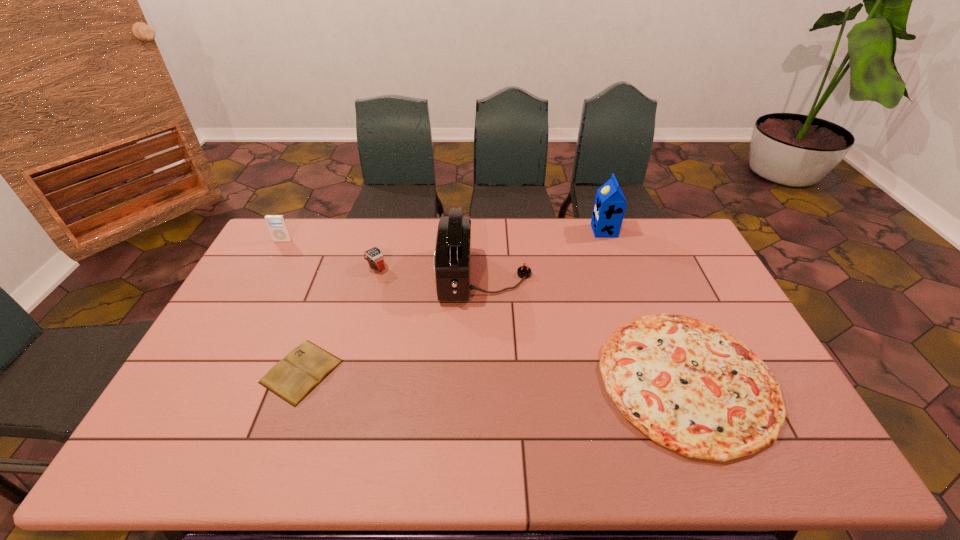
Locate an element on the screen. Image resolution: width=960 pixels, height=540 pixels. free region at the near left corner of the desktop is located at coordinates (203, 459).

Image resolution: width=960 pixels, height=540 pixels. In order to click on vacant area that lies between the shortest object and the second shortest object in this screenshot , I will do `click(494, 376)`.

Image resolution: width=960 pixels, height=540 pixels. What are the coordinates of `empty space between the shortest object and the leftmost object` in the screenshot? It's located at (292, 306).

I want to click on vacant region between the farthest object and the second shortest object, so click(x=645, y=305).

Find the location of a particular element. free space that is in between the watch and the book is located at coordinates (339, 320).

The width and height of the screenshot is (960, 540). Identify the location of vacant space that is in between the third shortest object and the shortest object. (339, 320).

What are the coordinates of `free space between the second farthest object and the book` in the screenshot? It's located at (292, 306).

Identify the location of free spot between the fifth tallest object and the watch. (532, 323).

Point out which object is positioned as the nearest to the carton. Please provide its 2D coordinates. Your answer should be formatted as a tuple, i.e. [(x, y)], where the tuple contains the x and y coordinates of a point satisfying the conditions above.

[(452, 256)]

Locate an element on the screen. This screenshot has height=540, width=960. object that can be found as the closest to the carton is located at coordinates (452, 256).